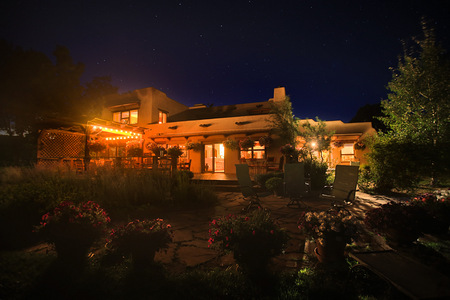
Locate an element on the screen. The image size is (450, 300). door is located at coordinates (206, 157).